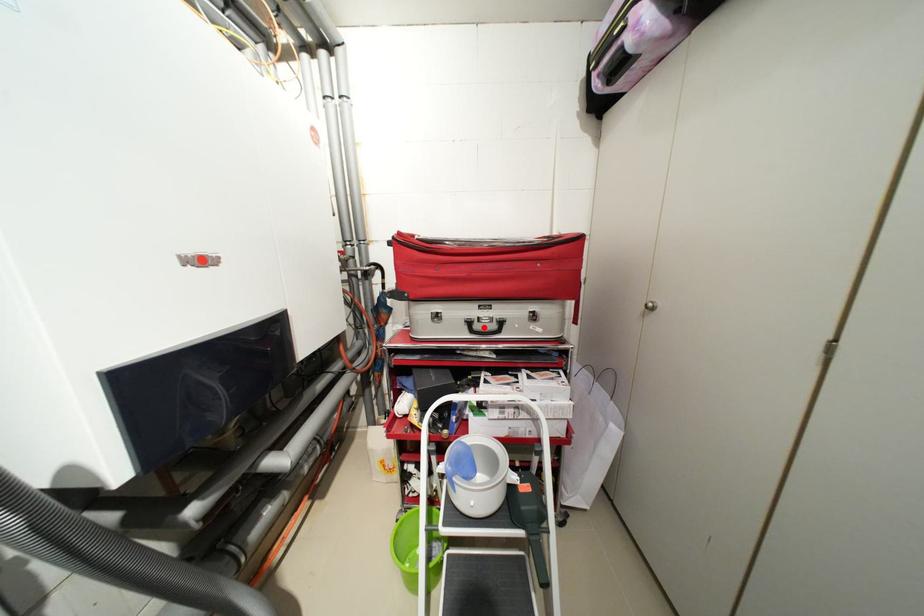
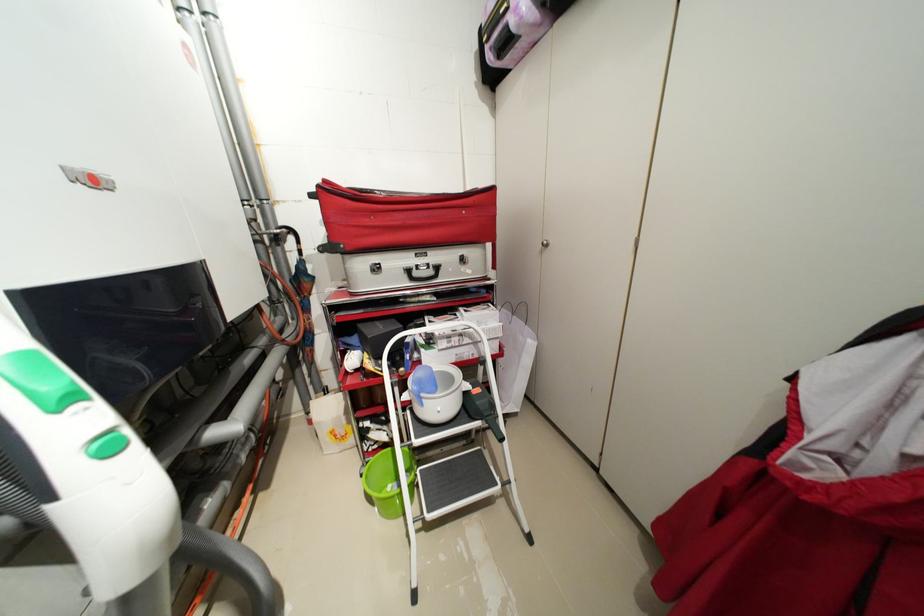
The point at the highlighted location is marked in the first image. Where is the corresponding point in the second image?

(422, 275)